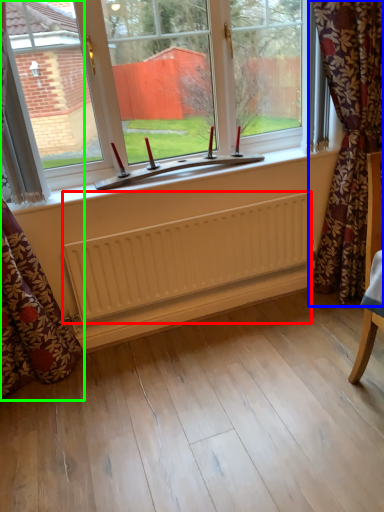
Question: Based on their relative distances, which object is farther from radiator (highlighted by a red box)? Choose from curtain (highlighted by a blue box) and curtain (highlighted by a green box).

Choices:
 (A) curtain
 (B) curtain

Answer: (A)